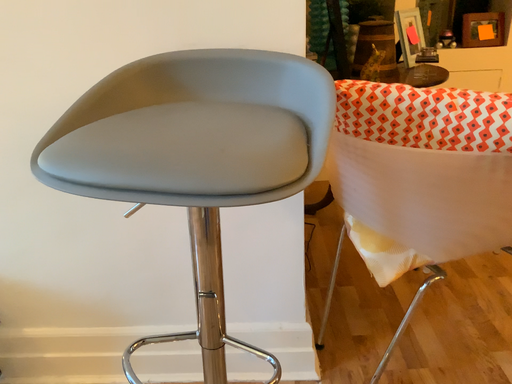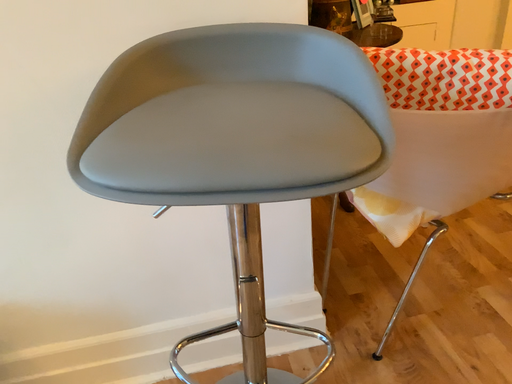
Question: Which way did the camera rotate in the video?

Choices:
 (A) rotated right
 (B) rotated left

Answer: (A)